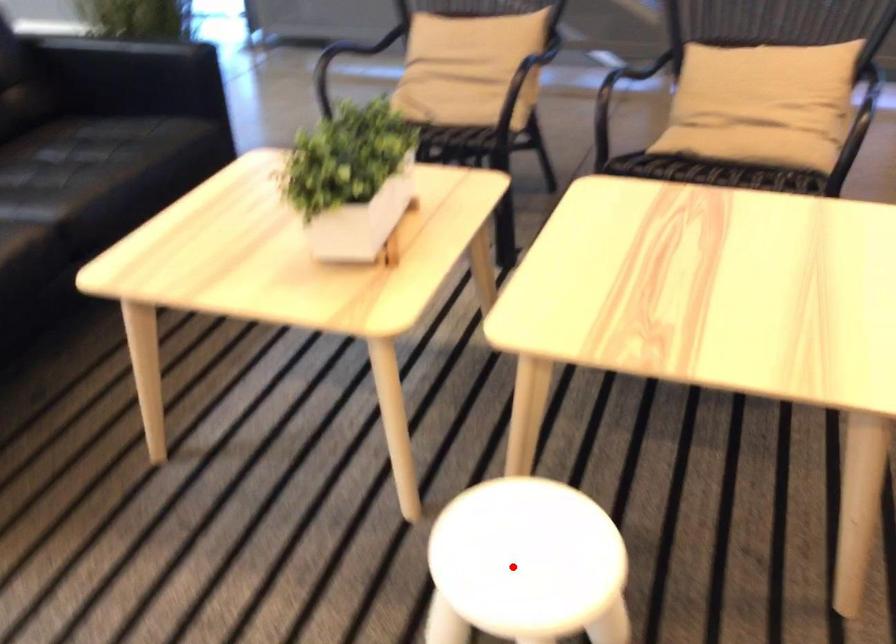
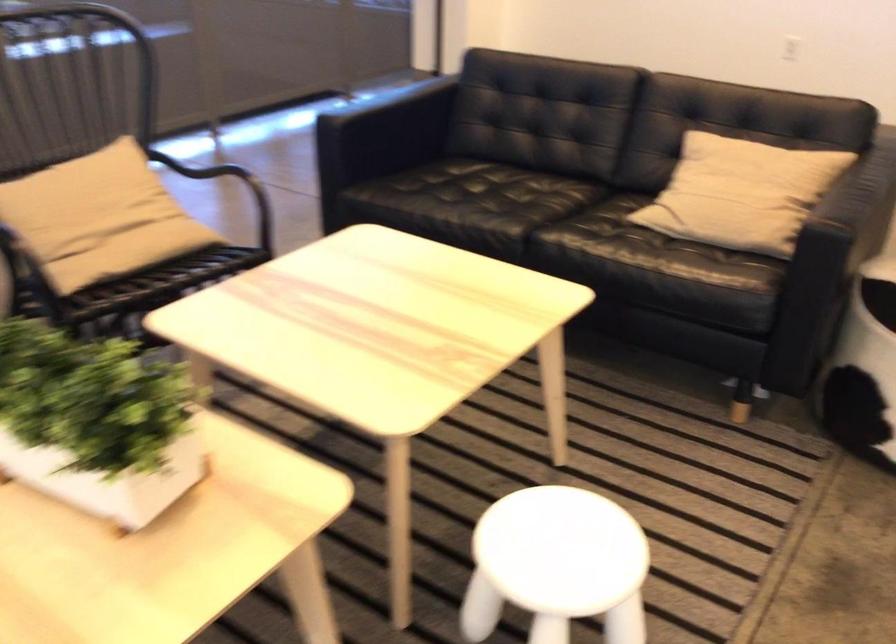
The point at the highlighted location is marked in the first image. Where is the corresponding point in the second image?

(556, 565)